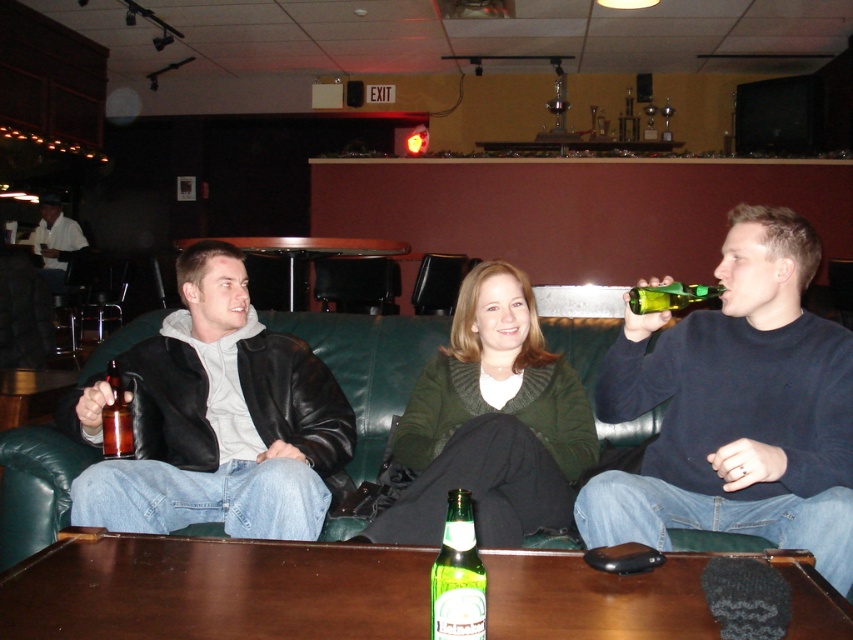
Question: Can you confirm if wooden round table at center is positioned to the left of green glass bottle at upper right?

Choices:
 (A) yes
 (B) no

Answer: (A)

Question: Does wooden round table at center come in front of green glass bottle at upper right?

Choices:
 (A) no
 (B) yes

Answer: (A)

Question: Is the position of wooden round table at center less distant than that of translucent amber glass beer bottle at left?

Choices:
 (A) yes
 (B) no

Answer: (B)

Question: Which object appears farthest from the camera in this image?

Choices:
 (A) green leather couch at center
 (B) green glass beer bottle at lower center
 (C) translucent amber glass beer bottle at left

Answer: (B)

Question: Which object is farther from the camera taking this photo?

Choices:
 (A) dark blue sweater at right
 (B) green glass beer bottle at lower center
 (C) matte black jacket at center
 (D) white shirt at left

Answer: (D)

Question: Which of the following is the closest to the observer?

Choices:
 (A) (479, 586)
 (B) (201, 557)

Answer: (A)